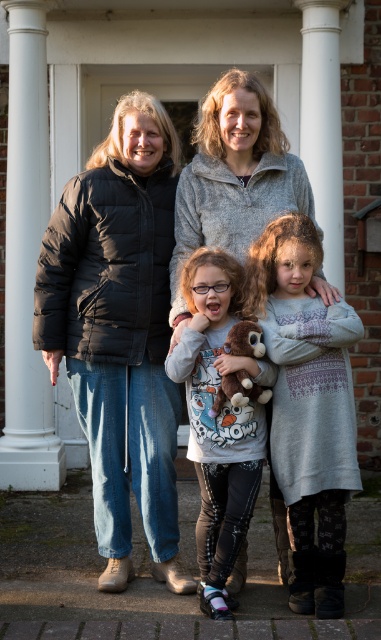
Locate an element on the screen. This screenshot has width=381, height=640. grey knit dress at center is located at coordinates (307, 406).

Is grey knit dress at center positioned behind matte gray sweater at center?

Yes, it is behind matte gray sweater at center.

Is point (302, 609) positioned before point (246, 456)?

Yes, point (302, 609) is in front of point (246, 456).

Where is `grey knit dress at center`? grey knit dress at center is located at coordinates (307, 406).

Which is behind, point (172, 280) or point (238, 353)?

The point (172, 280) is more distant.

Consider the image. Is matte black jacket at left to the left of brown plush toy at center from the viewer's perspective?

In fact, matte black jacket at left is to the right of brown plush toy at center.

This screenshot has height=640, width=381. What do you see at coordinates (235, 176) in the screenshot?
I see `matte black jacket at left` at bounding box center [235, 176].

This screenshot has width=381, height=640. I want to click on matte black jacket at left, so click(x=235, y=176).

Can you confirm if matte gray sweater at center is taller than brown plush toy at center?

Indeed, matte gray sweater at center has a greater height compared to brown plush toy at center.

Which is above, matte gray sweater at center or brown plush toy at center?

Positioned higher is brown plush toy at center.

Is point (273, 372) in front of point (216, 412)?

No, it is not.

What are the coordinates of `matte gray sweater at center` in the screenshot? It's located at (217, 420).